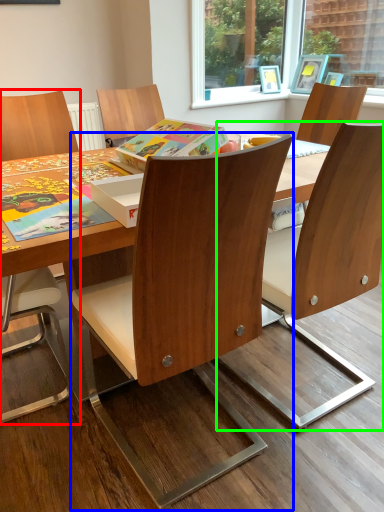
Question: Which object is positioned farthest from chair (highlighted by a red box)? Select from chair (highlighted by a blue box) and chair (highlighted by a green box).

Choices:
 (A) chair
 (B) chair

Answer: (B)